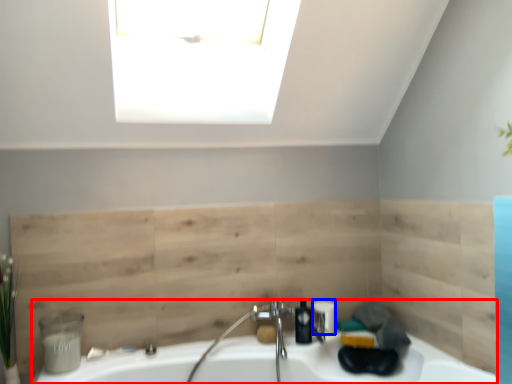
Question: Among these objects, which one is nearest to the camera, sink (highlighted by a red box) or toiletry (highlighted by a blue box)?

Choices:
 (A) sink
 (B) toiletry

Answer: (A)